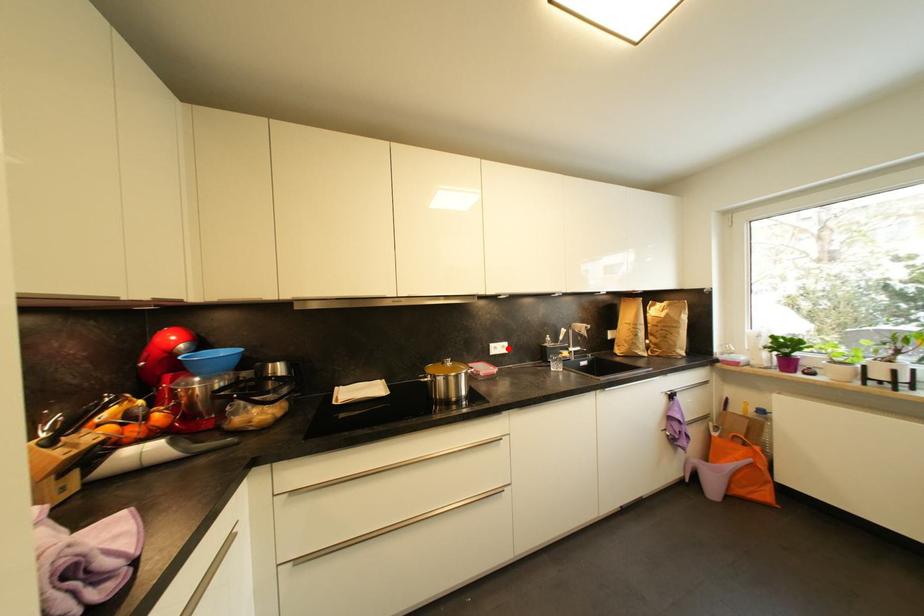
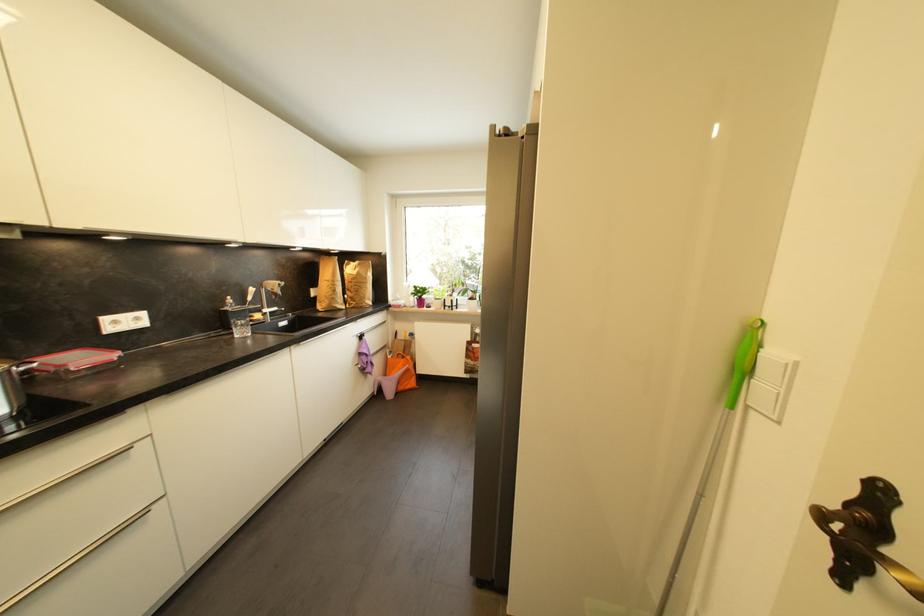
Locate, in the second image, the point that corresponds to the highlighted location in the first image.

(142, 321)